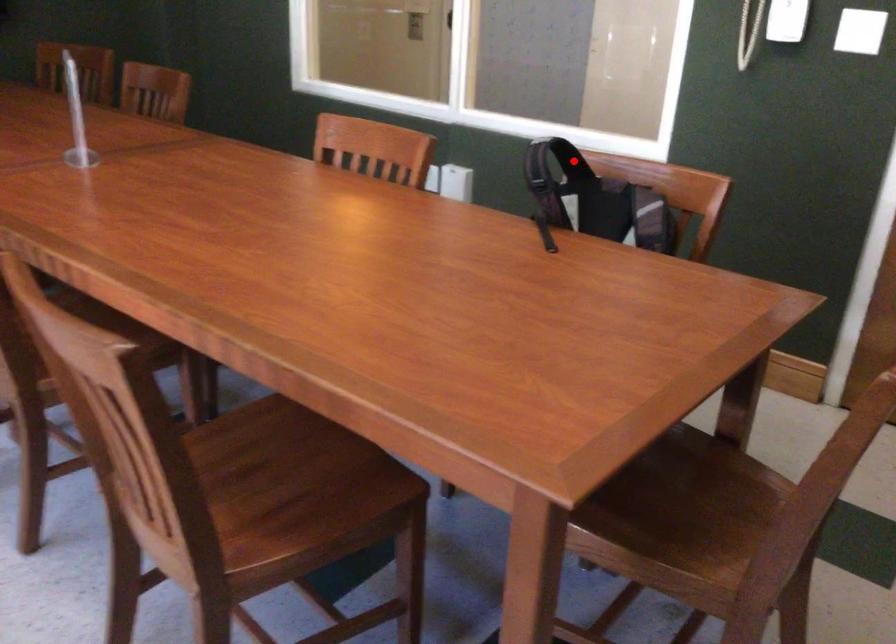
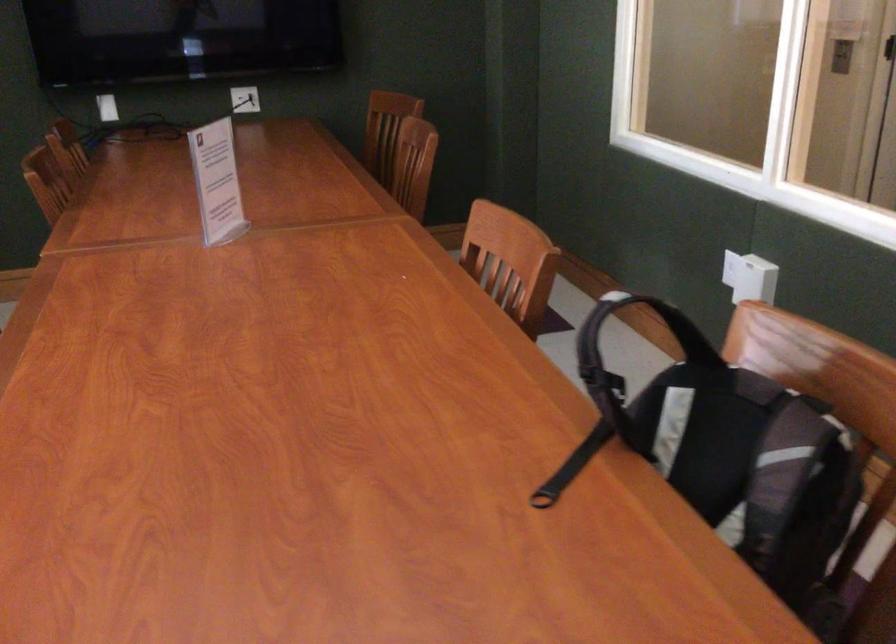
Find the pixel in the second image that matches the highlighted location in the first image.

(690, 337)